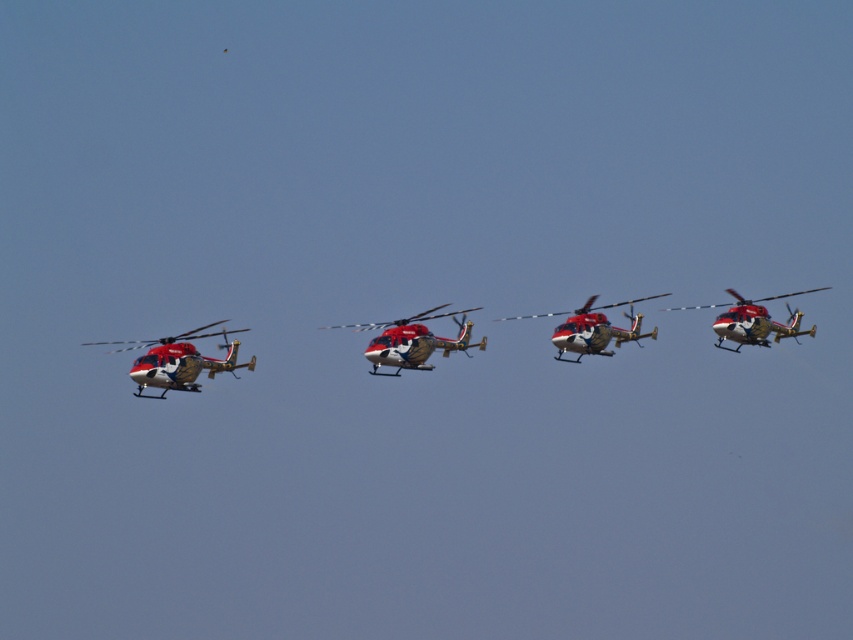
Which is in front, point (612, 337) or point (733, 307)?

Point (612, 337) is more forward.

Does metallic gold helicopter at center appear on the left side of metallic gold helicopter at right?

Indeed, metallic gold helicopter at center is positioned on the left side of metallic gold helicopter at right.

What do you see at coordinates (593, 328) in the screenshot? I see `metallic gold helicopter at center` at bounding box center [593, 328].

This screenshot has width=853, height=640. I want to click on metallic gold helicopter at center, so [593, 328].

Is metallic red helicopter at left positioned at the back of metallic gold helicopter at center?

No, it is in front of metallic gold helicopter at center.

Is metallic red helicopter at left smaller than metallic gold helicopter at center?

Actually, metallic red helicopter at left might be larger than metallic gold helicopter at center.

Who is more distant from viewer, (183,387) or (560,353)?

The point (560,353) is more distant.

At what (x,y) coordinates should I click in order to perform the action: click on metallic red helicopter at left. Please return your answer as a coordinate pair (x, y). Looking at the image, I should click on (178, 358).

Consider the image. Measure the distance between point [148,349] and camera.

Point [148,349] is 94.46 meters away from camera.

Is metallic red helicopter at left below metallic red helicopter at center?

Correct, metallic red helicopter at left is located below metallic red helicopter at center.

Between point (212, 369) and point (421, 324), which one is positioned in front?

Positioned in front is point (421, 324).

This screenshot has width=853, height=640. I want to click on metallic red helicopter at left, so click(178, 358).